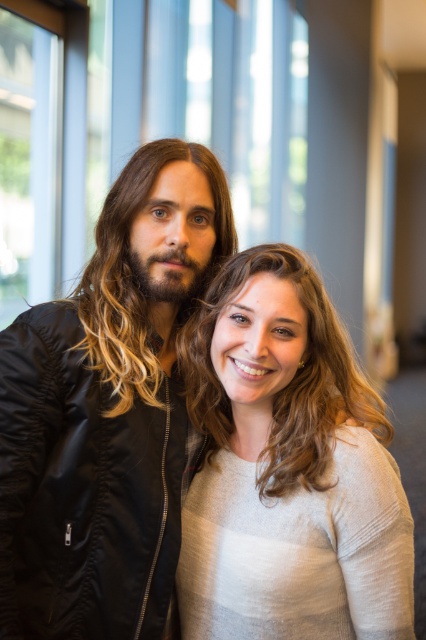
Is light gray sweater at center shorter than brownsmoothhair at center?

In fact, light gray sweater at center may be taller than brownsmoothhair at center.

The height and width of the screenshot is (640, 426). What do you see at coordinates (287, 468) in the screenshot?
I see `light gray sweater at center` at bounding box center [287, 468].

I want to click on light gray sweater at center, so click(287, 468).